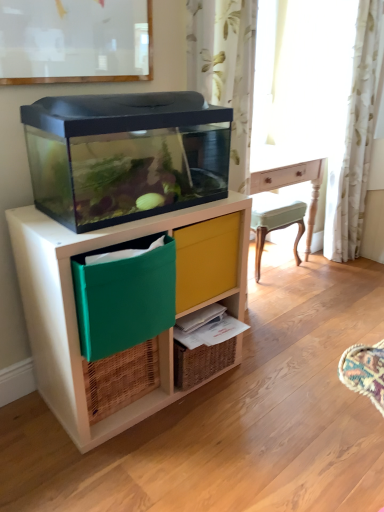
Identify the location of vacant area that is situated to the right of woven wood shelf at lower center. (261, 371).